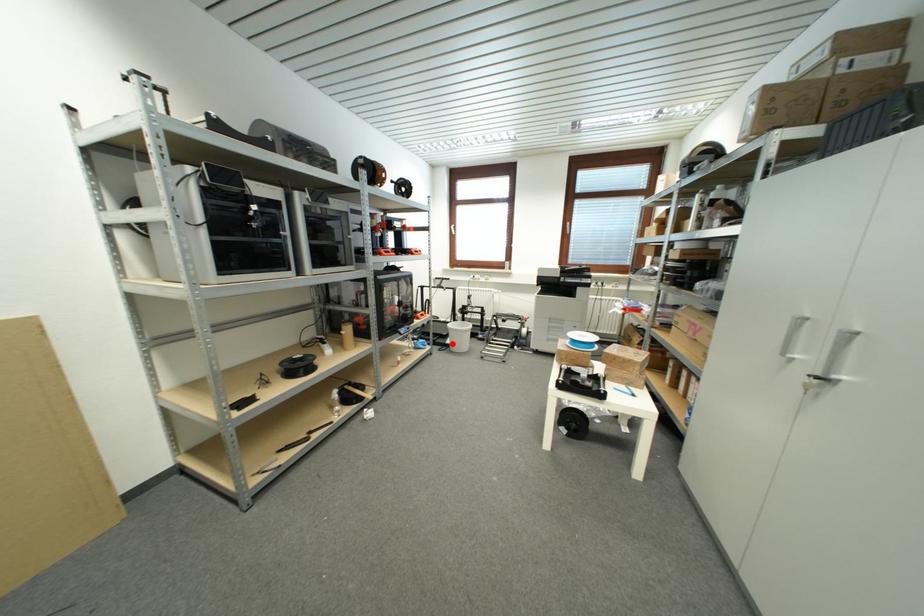
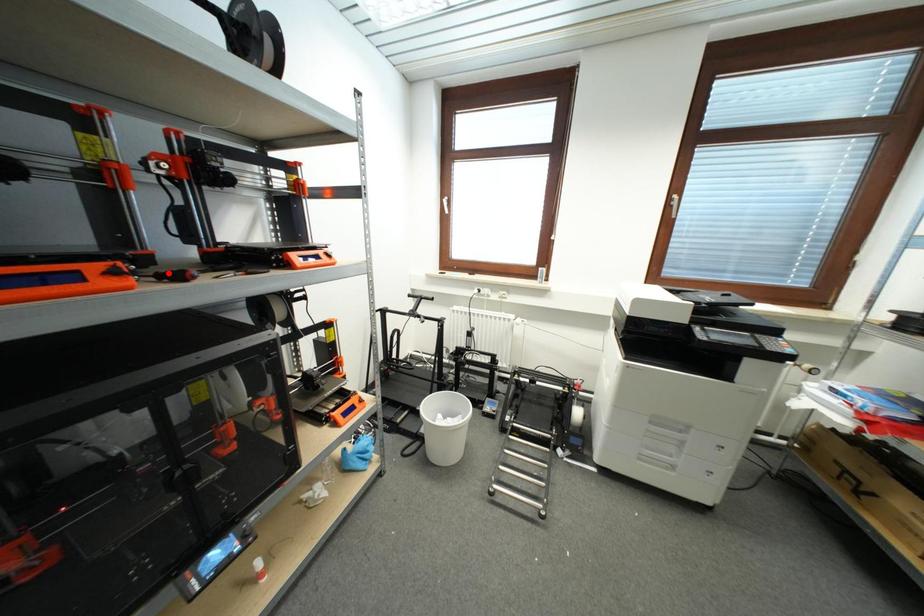
Based on the photo, I am providing you with two images of the same scene from different viewpoints. A red point is marked on the first image and another point is marked on the second image. Are the points marked in image1 and image2 representing the same 3D position?

No